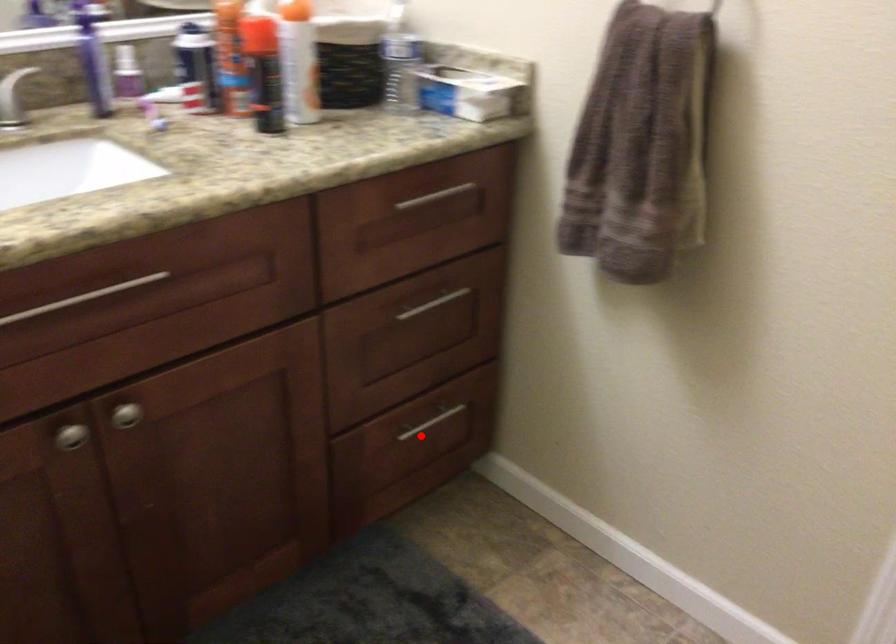
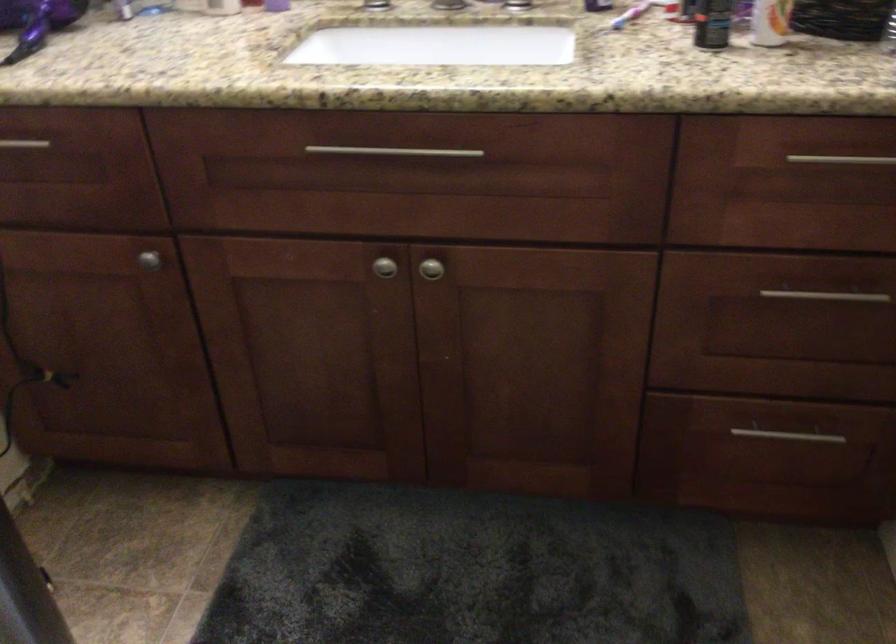
Question: I am providing you with two images of the same scene from different viewpoints. In image1, a red point is highlighted. Considering the same 3D point in image2, which of the following is correct?

Choices:
 (A) It is closer
 (B) It is farther

Answer: (A)